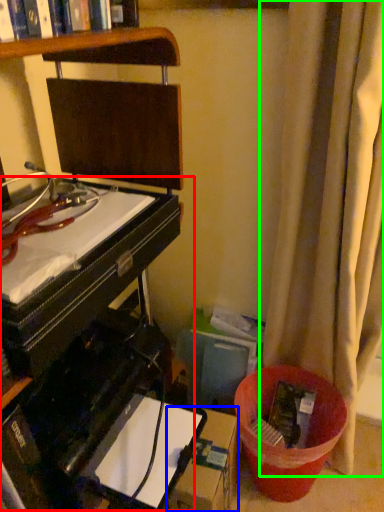
Question: Which object is positioned farthest from computer desk (highlighted by a red box)? Select from cardboard box (highlighted by a blue box) and curtain (highlighted by a green box).

Choices:
 (A) cardboard box
 (B) curtain

Answer: (B)